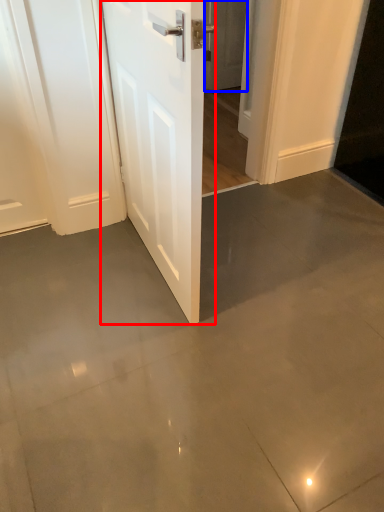
Question: Which of the following is the closest to the observer, door (highlighted by a red box) or door (highlighted by a blue box)?

Choices:
 (A) door
 (B) door

Answer: (A)